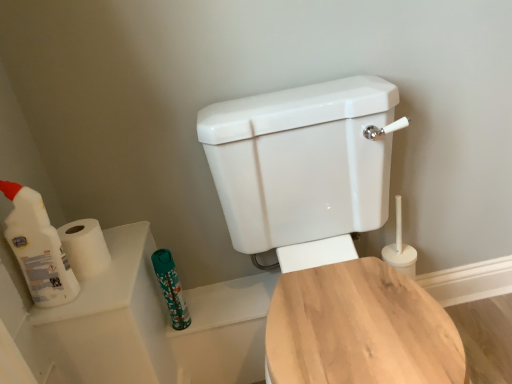
Question: Is wooden toilet seat at center, which is the second toilet in front-to-back order, far away from teal fabric toiletry at lower center?

Choices:
 (A) yes
 (B) no

Answer: (B)

Question: From the image's perspective, does wooden toilet seat at center, which is the second toilet in front-to-back order, appear higher than teal fabric toiletry at lower center?

Choices:
 (A) yes
 (B) no

Answer: (B)

Question: Is wooden toilet seat at center, which is the second toilet in front-to-back order, in contact with teal fabric toiletry at lower center?

Choices:
 (A) yes
 (B) no

Answer: (B)

Question: Is wooden toilet seat at center, arranged as the 1th toilet when viewed from the back, looking in the opposite direction of teal fabric toiletry at lower center?

Choices:
 (A) yes
 (B) no

Answer: (B)

Question: Considering the relative sizes of wooden toilet seat at center, which is the second toilet in front-to-back order, and teal fabric toiletry at lower center in the image provided, is wooden toilet seat at center, which is the second toilet in front-to-back order, taller than teal fabric toiletry at lower center?

Choices:
 (A) no
 (B) yes

Answer: (A)

Question: From a real-world perspective, relative to teal fabric toiletry at lower center, is white glossy toilet at center, placed as the 2th toilet when sorted from back to front, vertically above or below?

Choices:
 (A) above
 (B) below

Answer: (A)

Question: Do you think white glossy toilet at center, acting as the 1th toilet starting from the front, is within teal fabric toiletry at lower center, or outside of it?

Choices:
 (A) outside
 (B) inside

Answer: (A)

Question: In the image, is white glossy toilet at center, acting as the 1th toilet starting from the front, on the left side or the right side of teal fabric toiletry at lower center?

Choices:
 (A) left
 (B) right

Answer: (B)

Question: Is point (274, 372) positioned closer to the camera than point (159, 276)?

Choices:
 (A) closer
 (B) farther

Answer: (A)

Question: From the image's perspective, is white plastic bottle at left located above or below teal fabric toiletry at lower center?

Choices:
 (A) above
 (B) below

Answer: (A)

Question: Is white plastic bottle at left inside the boundaries of teal fabric toiletry at lower center, or outside?

Choices:
 (A) inside
 (B) outside

Answer: (B)

Question: From a real-world perspective, relative to teal fabric toiletry at lower center, is white plastic bottle at left vertically above or below?

Choices:
 (A) below
 (B) above

Answer: (B)

Question: Relative to teal fabric toiletry at lower center, is white plastic bottle at left in front or behind?

Choices:
 (A) behind
 (B) front

Answer: (B)

Question: Is white matte toilet paper at left taller or shorter than white glossy toilet at center, placed as the 2th toilet when sorted from back to front?

Choices:
 (A) short
 (B) tall

Answer: (A)

Question: In the image, is white matte toilet paper at left positioned in front of or behind white glossy toilet at center, placed as the 2th toilet when sorted from back to front?

Choices:
 (A) front
 (B) behind

Answer: (B)